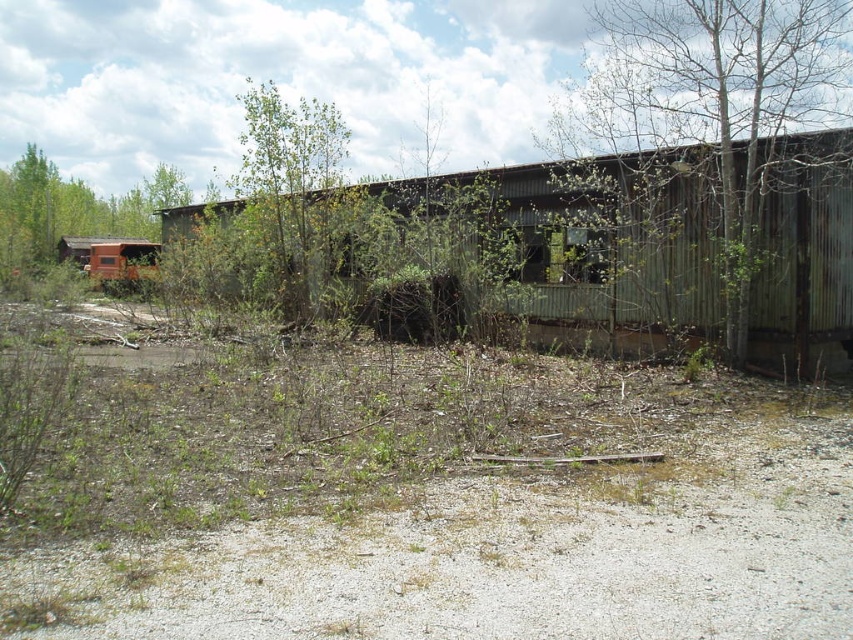
You are standing at the point closest to the weathered corrugated metal structure in the image. Which point, point [677,536] or point [798,122], is closer to you?

Point [677,536] is in front of point [798,122], so it is closer to you.

You are standing in front of the weathered metal structure and want to determine the relative positions of two points marked in the scene. Which point, point [619,570] or point [49,252], is closer to you?

Point [619,570] is closer to the camera than point [49,252].

You are a gardener who wants to plant a new flower bed between the dull brown dirt at center and the green leafy tree at center. Which area has more space available for planting?

The dull brown dirt at center is thinner than the green leafy tree at center, so there is more space available in the area of the green leafy tree at center for planting.